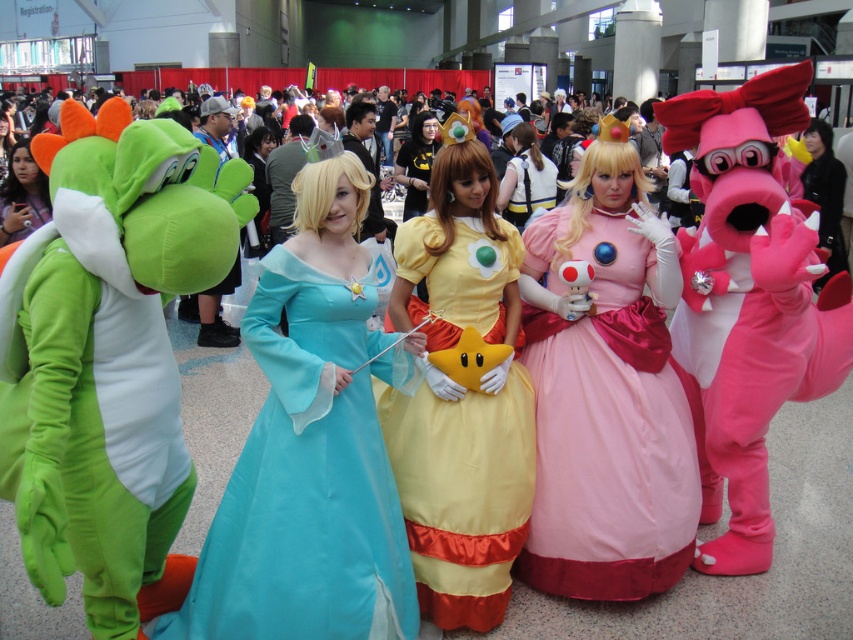
Question: Does matte blue dress at center come in front of pink satin dress at center?

Choices:
 (A) yes
 (B) no

Answer: (A)

Question: Estimate the real-world distances between objects in this image. Which object is closer to the matte blue dress at center?

Choices:
 (A) light brown fabric dress at center
 (B) yellow satin dress at center
 (C) pink satin dress at center

Answer: (B)

Question: Which of the following is the farthest from the observer?

Choices:
 (A) matte green costume at left
 (B) matte blue dress at center
 (C) yellow satin dress at center

Answer: (A)

Question: Does matte blue dress at center lie in front of pink satin dress at center?

Choices:
 (A) no
 (B) yes

Answer: (B)

Question: Which point appears closest to the camera in this image?

Choices:
 (A) (519, 196)
 (B) (495, 426)

Answer: (B)

Question: Can you confirm if matte blue dress at center is positioned above yellow satin dress at center?

Choices:
 (A) yes
 (B) no

Answer: (B)